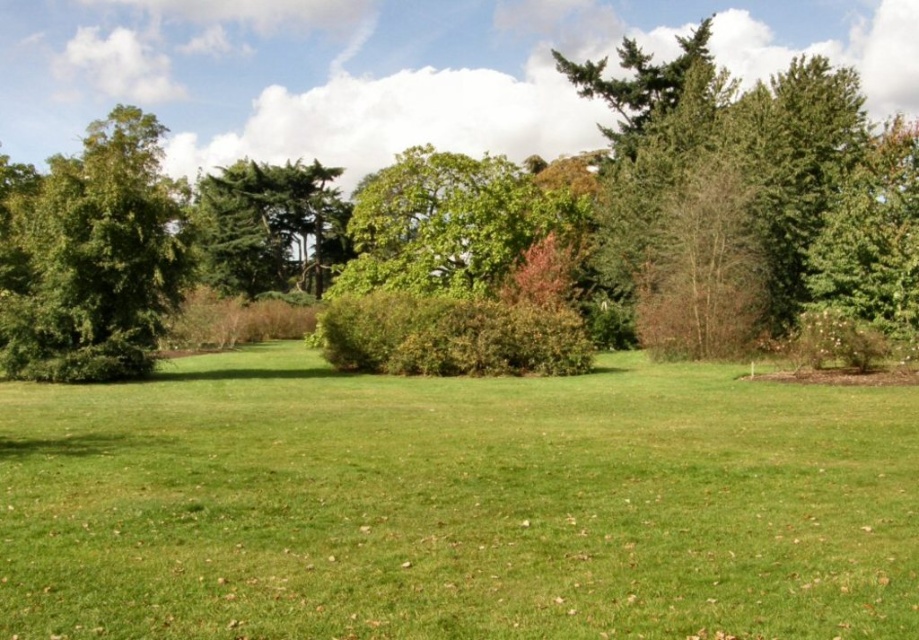
Can you confirm if green leafy tree at center is shorter than green leafy tree at left?

Incorrect, green leafy tree at center's height does not fall short of green leafy tree at left's.

Is point (456, 132) more distant than point (111, 166)?

That is True.

Locate an element on the screen. Image resolution: width=919 pixels, height=640 pixels. green leafy tree at center is located at coordinates (392, 68).

Between point (456, 435) and point (305, 186), which one is positioned in front?

Positioned in front is point (456, 435).

Which is behind, point (262, 561) or point (308, 214)?

Positioned behind is point (308, 214).

The height and width of the screenshot is (640, 919). I want to click on green grass at center, so click(x=455, y=506).

Measure the distance from green grass at center to green leafy tree at center.

They are 223.72 meters apart.

I want to click on green grass at center, so click(x=455, y=506).

Who is more distant from viewer, (772, 536) or (280, 116)?

Positioned behind is point (280, 116).

Find the location of a particular element. This screenshot has height=640, width=919. green grass at center is located at coordinates (455, 506).